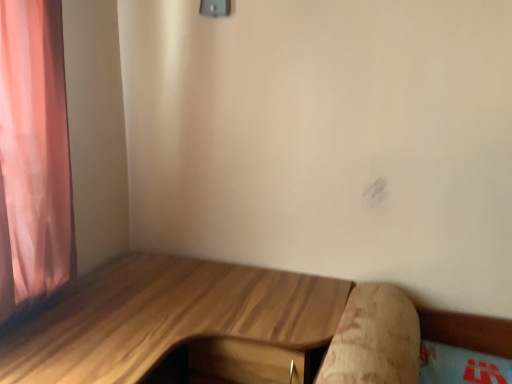
Measure the distance between point (192, 282) and camera.

The depth of point (192, 282) is 5.43 feet.

Describe the element at coordinates (166, 317) in the screenshot. The image size is (512, 384). I see `wooden desk at left` at that location.

I want to click on wooden desk at left, so click(166, 317).

You are a GUI agent. You are given a task and a screenshot of the screen. Output one action in this format:
    pyautogui.click(x=<x>, y=<y>)
    Task: Click on the wooden desk at left
    This screenshot has height=384, width=512.
    Given the screenshot: What is the action you would take?
    pyautogui.click(x=166, y=317)